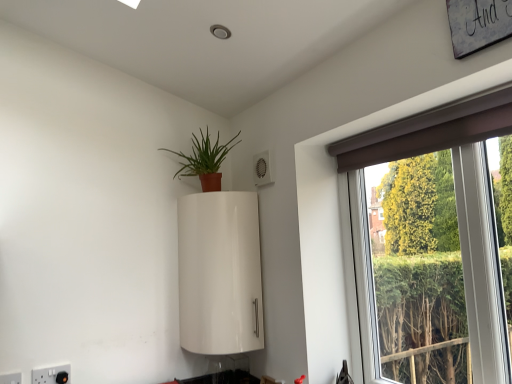
What is the approximate height of brown fabric window at upper right?

It is 1.01 meters.

This screenshot has width=512, height=384. What are the coordinates of `brown fabric window at upper right` in the screenshot? It's located at click(x=430, y=130).

Where is `white glossy cabinet at upper center`? This screenshot has width=512, height=384. white glossy cabinet at upper center is located at coordinates (220, 273).

Where is `white plastic electric outlet at lower left, the first electric outlet viewed from the front`? The width and height of the screenshot is (512, 384). white plastic electric outlet at lower left, the first electric outlet viewed from the front is located at coordinates (11, 378).

Image resolution: width=512 pixels, height=384 pixels. What are the coordinates of `brown fabric window at upper right` in the screenshot? It's located at (430, 130).

Between white plastic electric outlet at lower left, positioned as the 2th electric outlet in front-to-back order, and white glossy cabinet at upper center, which one has less height?

white plastic electric outlet at lower left, positioned as the 2th electric outlet in front-to-back order, is shorter.

Could you tell me if white plastic electric outlet at lower left, which is the first electric outlet in right-to-left order, is turned towards white glossy cabinet at upper center?

No, white plastic electric outlet at lower left, which is the first electric outlet in right-to-left order, does not turn towards white glossy cabinet at upper center.

Are white plastic electric outlet at lower left, which appears as the 1th electric outlet when viewed from the back, and white glossy cabinet at upper center located far from each other?

white plastic electric outlet at lower left, which appears as the 1th electric outlet when viewed from the back, is actually quite close to white glossy cabinet at upper center.

From the image's perspective, is white plastic electric outlet at lower left, the first electric outlet viewed from the front, located above or below brown fabric window at upper right?

Clearly, from the image's perspective, white plastic electric outlet at lower left, the first electric outlet viewed from the front, is below brown fabric window at upper right.

How different are the orientations of white plastic electric outlet at lower left, which is the 2th electric outlet in back-to-front order, and brown fabric window at upper right in degrees?

white plastic electric outlet at lower left, which is the 2th electric outlet in back-to-front order, and brown fabric window at upper right are facing 91.4 degrees away from each other.

Starting from the brown fabric window at upper right, which electric outlet is the 2nd one to the left? Please provide its 2D coordinates.

[(11, 378)]

Considering the relative sizes of white glossy cabinet at upper center and brown fabric window at upper right in the image provided, is white glossy cabinet at upper center wider than brown fabric window at upper right?

Yes.

Find the location of a particular element. Image resolution: width=512 pixels, height=384 pixels. appliance on the left side of brown fabric window at upper right is located at coordinates (220, 273).

Is white glossy cabinet at upper center looking in the opposite direction of brown fabric window at upper right?

No, brown fabric window at upper right is not at the back of white glossy cabinet at upper center.

From the image's perspective, is white glossy cabinet at upper center on brown fabric window at upper right?

No, from the image's perspective, white glossy cabinet at upper center is not on top of brown fabric window at upper right.

Which is closer, [482,115] or [200,247]?

The point [482,115] is closer to the camera.

Is the surface of brown fabric window at upper right in direct contact with white glossy cabinet at upper center?

brown fabric window at upper right and white glossy cabinet at upper center are clearly separated.

Is white glossy cabinet at upper center located within brown fabric window at upper right?

Definitely not — white glossy cabinet at upper center is not inside brown fabric window at upper right.

Between brown fabric window at upper right and white glossy cabinet at upper center, which one has less height?

white glossy cabinet at upper center is shorter.

Considering the relative positions of white plastic electric outlet at lower left, which is the first electric outlet in right-to-left order, and white plastic electric outlet at lower left, the first electric outlet viewed from the front, in the image provided, is white plastic electric outlet at lower left, which is the first electric outlet in right-to-left order, to the left or to the right of white plastic electric outlet at lower left, the first electric outlet viewed from the front,?

Clearly, white plastic electric outlet at lower left, which is the first electric outlet in right-to-left order, is on the right of white plastic electric outlet at lower left, the first electric outlet viewed from the front, in the image.

Who is bigger, white plastic electric outlet at lower left, positioned as the 2th electric outlet in front-to-back order, or white plastic electric outlet at lower left, the first electric outlet viewed from the front?

white plastic electric outlet at lower left, positioned as the 2th electric outlet in front-to-back order.

Is white plastic electric outlet at lower left, positioned as the 2th electric outlet in front-to-back order, spatially inside white plastic electric outlet at lower left, the first electric outlet viewed from the front, or outside of it?

white plastic electric outlet at lower left, positioned as the 2th electric outlet in front-to-back order, is outside white plastic electric outlet at lower left, the first electric outlet viewed from the front.

Is there a large distance between matte terracotta pot at upper center and brown fabric window at upper right?

matte terracotta pot at upper center is actually quite close to brown fabric window at upper right.

Between matte terracotta pot at upper center and brown fabric window at upper right, which one is positioned behind?

Positioned behind is matte terracotta pot at upper center.

Find the location of `houseplant behind the brown fabric window at upper right`. houseplant behind the brown fabric window at upper right is located at coordinates (204, 160).

Considering the sizes of objects matte terracotta pot at upper center and brown fabric window at upper right in the image provided, who is thinner, matte terracotta pot at upper center or brown fabric window at upper right?

With smaller width is brown fabric window at upper right.

Is white plastic electric outlet at lower left, the first electric outlet viewed from the front, bigger or smaller than white glossy cabinet at upper center?

white plastic electric outlet at lower left, the first electric outlet viewed from the front, is smaller than white glossy cabinet at upper center.

Between point (15, 374) and point (189, 247), which one is positioned behind?

Positioned behind is point (189, 247).

Is white glossy cabinet at upper center located within white plastic electric outlet at lower left, which is counted as the second electric outlet, starting from the right?

No, white glossy cabinet at upper center is not inside white plastic electric outlet at lower left, which is counted as the second electric outlet, starting from the right.

Identify the location of appliance behind the white plastic electric outlet at lower left, which is the first electric outlet in right-to-left order. This screenshot has width=512, height=384. (220, 273).

This screenshot has width=512, height=384. Identify the location of window located in front of the white plastic electric outlet at lower left, which is counted as the second electric outlet, starting from the right. (430, 130).

Which object lies nearer to the anchor point white glossy cabinet at upper center, brown fabric window at upper right or white plastic electric outlet at lower left, placed as the first electric outlet when sorted from left to right?

Based on the image, brown fabric window at upper right appears to be nearer to white glossy cabinet at upper center.

Based on their spatial positions, is white glossy cabinet at upper center or white plastic electric outlet at lower left, positioned as the 2th electric outlet in front-to-back order, further from brown fabric window at upper right?

white plastic electric outlet at lower left, positioned as the 2th electric outlet in front-to-back order, lies further to brown fabric window at upper right than the other object.

When comparing their distances from white glossy cabinet at upper center, does white plastic electric outlet at lower left, positioned as the 2th electric outlet in front-to-back order, or brown fabric window at upper right seem further?

white plastic electric outlet at lower left, positioned as the 2th electric outlet in front-to-back order, is further to white glossy cabinet at upper center.

Estimate the real-world distances between objects in this image. Which object is further from white glossy cabinet at upper center, matte terracotta pot at upper center or white plastic electric outlet at lower left, which is the first electric outlet in right-to-left order?

The object further to white glossy cabinet at upper center is white plastic electric outlet at lower left, which is the first electric outlet in right-to-left order.

Looking at the image, which one is located further to matte terracotta pot at upper center, white plastic electric outlet at lower left, which is the first electric outlet in right-to-left order, or white plastic electric outlet at lower left, which is the 2th electric outlet in back-to-front order?

white plastic electric outlet at lower left, which is the 2th electric outlet in back-to-front order, is positioned further to the anchor matte terracotta pot at upper center.

Based on the photo, considering their positions, is white glossy cabinet at upper center positioned further to matte terracotta pot at upper center than brown fabric window at upper right?

brown fabric window at upper right is positioned further to the anchor matte terracotta pot at upper center.

Considering their positions, is white plastic electric outlet at lower left, positioned as the 2th electric outlet in front-to-back order, positioned further to brown fabric window at upper right than matte terracotta pot at upper center?

Based on the image, white plastic electric outlet at lower left, positioned as the 2th electric outlet in front-to-back order, appears to be further to brown fabric window at upper right.

Which object lies further to the anchor point white plastic electric outlet at lower left, which is the 2th electric outlet in back-to-front order, brown fabric window at upper right or matte terracotta pot at upper center?

brown fabric window at upper right lies further to white plastic electric outlet at lower left, which is the 2th electric outlet in back-to-front order, than the other object.

You are a GUI agent. You are given a task and a screenshot of the screen. Output one action in this format:
    pyautogui.click(x=<x>, y=<y>)
    Task: Click on the appliance between matte terracotta pot at upper center and white plastic electric outlet at lower left, which is the 2th electric outlet in back-to-front order, from top to bottom
    This screenshot has width=512, height=384.
    Given the screenshot: What is the action you would take?
    pyautogui.click(x=220, y=273)

The width and height of the screenshot is (512, 384). Identify the location of appliance between white plastic electric outlet at lower left, the 2th electric outlet positioned from the left, and brown fabric window at upper right from left to right. (220, 273).

You are a GUI agent. You are given a task and a screenshot of the screen. Output one action in this format:
    pyautogui.click(x=<x>, y=<y>)
    Task: Click on the appliance between matte terracotta pot at upper center and white plastic electric outlet at lower left, which appears as the 1th electric outlet when viewed from the back, vertically
    The width and height of the screenshot is (512, 384).
    Given the screenshot: What is the action you would take?
    pyautogui.click(x=220, y=273)

Find the location of a particular element. Image resolution: width=512 pixels, height=384 pixels. electric outlet between matte terracotta pot at upper center and white plastic electric outlet at lower left, which appears as the 1th electric outlet when viewed from the back, vertically is located at coordinates (11, 378).